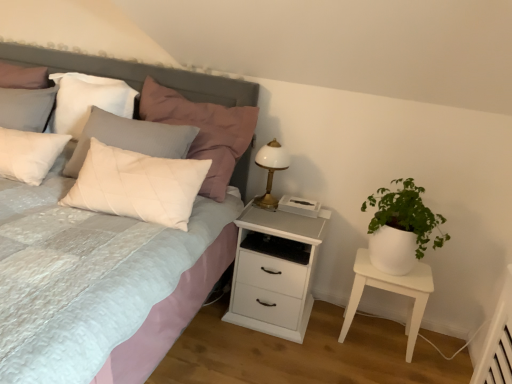
Question: Does white glossy bedside lamp at upper right have a lesser width compared to matte gray headboard at upper left?

Choices:
 (A) no
 (B) yes

Answer: (B)

Question: Is white glossy bedside lamp at upper right aimed at matte gray headboard at upper left?

Choices:
 (A) yes
 (B) no

Answer: (B)

Question: Is white glossy bedside lamp at upper right bigger than matte gray headboard at upper left?

Choices:
 (A) yes
 (B) no

Answer: (B)

Question: Is white glossy bedside lamp at upper right positioned behind matte gray headboard at upper left?

Choices:
 (A) no
 (B) yes

Answer: (B)

Question: Considering the relative positions of white glossy bedside lamp at upper right and matte gray headboard at upper left in the image provided, is white glossy bedside lamp at upper right to the left of matte gray headboard at upper left from the viewer's perspective?

Choices:
 (A) no
 (B) yes

Answer: (A)

Question: Is white glossy bedside lamp at upper right outside matte gray headboard at upper left?

Choices:
 (A) no
 (B) yes

Answer: (B)

Question: Is white quilted pillow at upper left, the 1th pillow positioned from the right, oriented away from white quilted fabric bed at upper left?

Choices:
 (A) no
 (B) yes

Answer: (B)

Question: Is white quilted pillow at upper left, the 1th pillow positioned from the right, thinner than white quilted fabric bed at upper left?

Choices:
 (A) no
 (B) yes

Answer: (B)

Question: Is white quilted pillow at upper left, which ranks as the 2th pillow in left-to-right order, completely or partially outside of white quilted fabric bed at upper left?

Choices:
 (A) no
 (B) yes

Answer: (A)

Question: Is white quilted pillow at upper left, which ranks as the 2th pillow in left-to-right order, touching white quilted fabric bed at upper left?

Choices:
 (A) no
 (B) yes

Answer: (A)

Question: From the image's perspective, is white quilted pillow at upper left, the 1th pillow positioned from the right, below white quilted fabric bed at upper left?

Choices:
 (A) no
 (B) yes

Answer: (A)

Question: Would you say white quilted fabric bed at upper left is part of white quilted pillow at upper left, the 1th pillow positioned from the right,'s contents?

Choices:
 (A) yes
 (B) no

Answer: (B)

Question: From the image's perspective, is white quilted pillow at upper left, the 1th pillow positioned from the right, on white matte table at right?

Choices:
 (A) yes
 (B) no

Answer: (A)